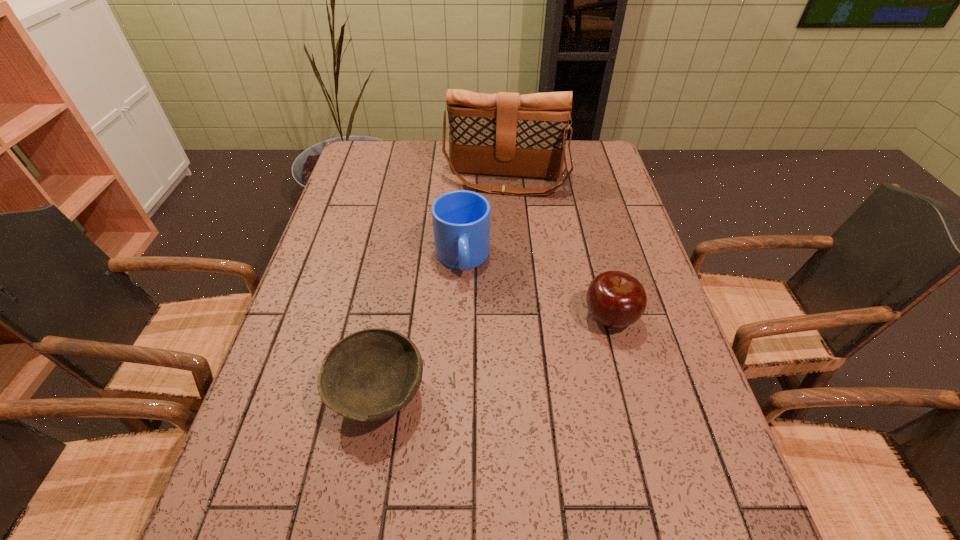
This screenshot has width=960, height=540. I want to click on the nearest object, so click(369, 375).

In order to click on bowl in this screenshot , I will do `click(369, 375)`.

Find the location of `the third farthest object`. the third farthest object is located at coordinates (615, 299).

Where is `the tallest object`? This screenshot has width=960, height=540. the tallest object is located at coordinates (507, 134).

Image resolution: width=960 pixels, height=540 pixels. In order to click on the farthest object in this screenshot , I will do `click(507, 134)`.

This screenshot has height=540, width=960. Find the location of `the second farthest object`. the second farthest object is located at coordinates (461, 219).

Locate an element on the screen. Image resolution: width=960 pixels, height=540 pixels. free space located on the right of the nearest object is located at coordinates (474, 394).

Locate an element on the screen. Image resolution: width=960 pixels, height=540 pixels. free space located 0.140m on the back of the second nearest object is located at coordinates click(x=594, y=259).

You are a GUI agent. You are given a task and a screenshot of the screen. Output one action in this format:
    pyautogui.click(x=<x>, y=<y>)
    Task: Click on the free space located 0.320m on the front-facing side of the shoulder bag
    This screenshot has width=960, height=540.
    Given the screenshot: What is the action you would take?
    pyautogui.click(x=489, y=268)

This screenshot has height=540, width=960. Identify the location of free location located on the front-facing side of the shoulder bag. (495, 228).